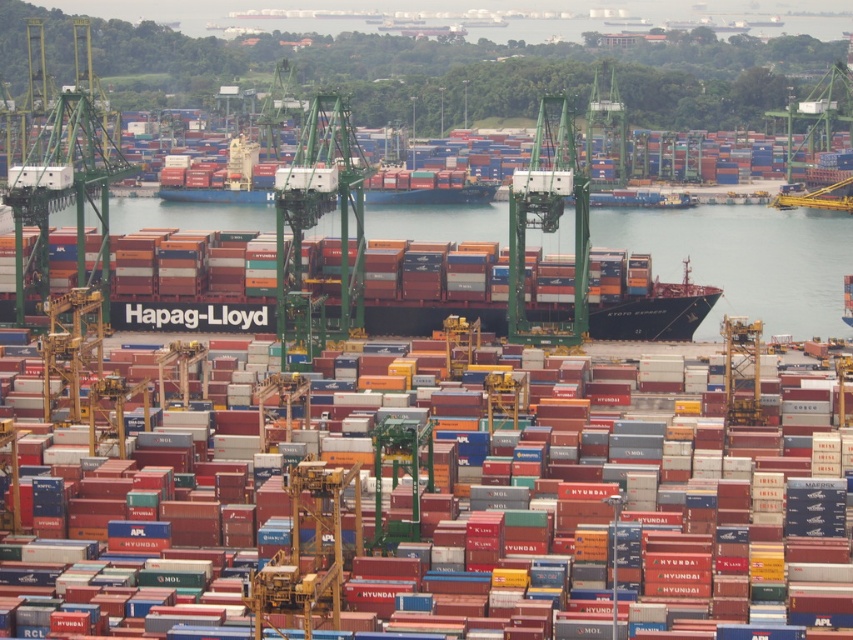
Between transparent water at center and metallic gray container at center, which one appears on the left side from the viewer's perspective?

transparent water at center is more to the left.

Who is more forward, (x=434, y=209) or (x=560, y=467)?

Point (x=560, y=467) is in front.

Image resolution: width=853 pixels, height=640 pixels. I want to click on transparent water at center, so click(746, 259).